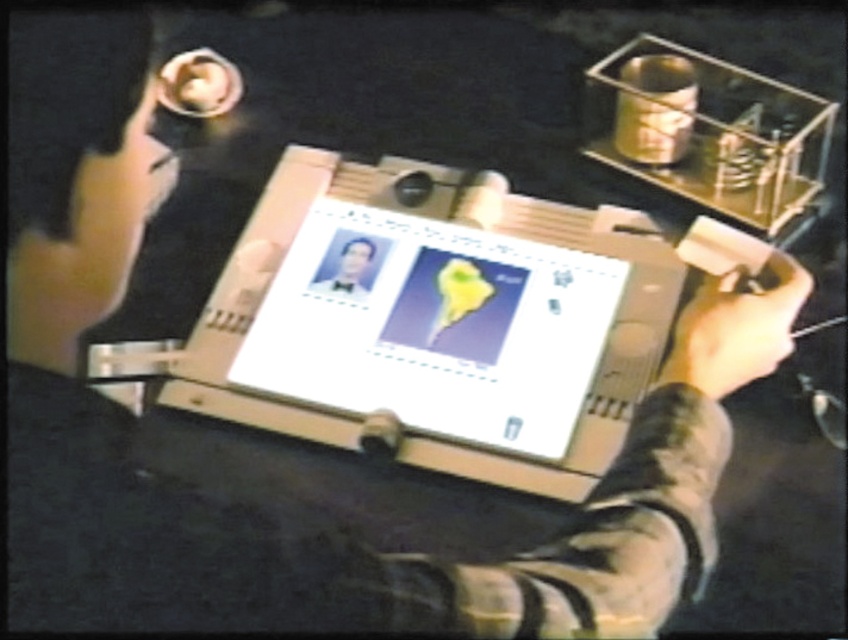
Can you confirm if matte black hand at center is positioned above smooth skin portrait at center?

No, matte black hand at center is not above smooth skin portrait at center.

Which is behind, point (796, 292) or point (318, 285)?

The point (318, 285) is behind.

What do you see at coordinates (735, 330) in the screenshot? Image resolution: width=848 pixels, height=640 pixels. I see `matte black hand at center` at bounding box center [735, 330].

The height and width of the screenshot is (640, 848). In order to click on matte black hand at center in this screenshot , I will do `click(735, 330)`.

Which is more to the right, matte plastic computer screen at center or smooth skin portrait at center?

matte plastic computer screen at center is more to the right.

Does point (394, 412) come closer to viewer compared to point (342, 285)?

That is True.

The height and width of the screenshot is (640, 848). Describe the element at coordinates (436, 328) in the screenshot. I see `matte plastic computer screen at center` at that location.

Find the location of `matte plastic computer screen at center`. matte plastic computer screen at center is located at coordinates (436, 328).

In the scene shown: Can you confirm if matte plastic computer screen at center is positioned above matte black hand at center?

Indeed, matte plastic computer screen at center is positioned over matte black hand at center.

Which of these two, matte plastic computer screen at center or matte black hand at center, stands taller?

Standing taller between the two is matte plastic computer screen at center.

The width and height of the screenshot is (848, 640). I want to click on matte plastic computer screen at center, so click(436, 328).